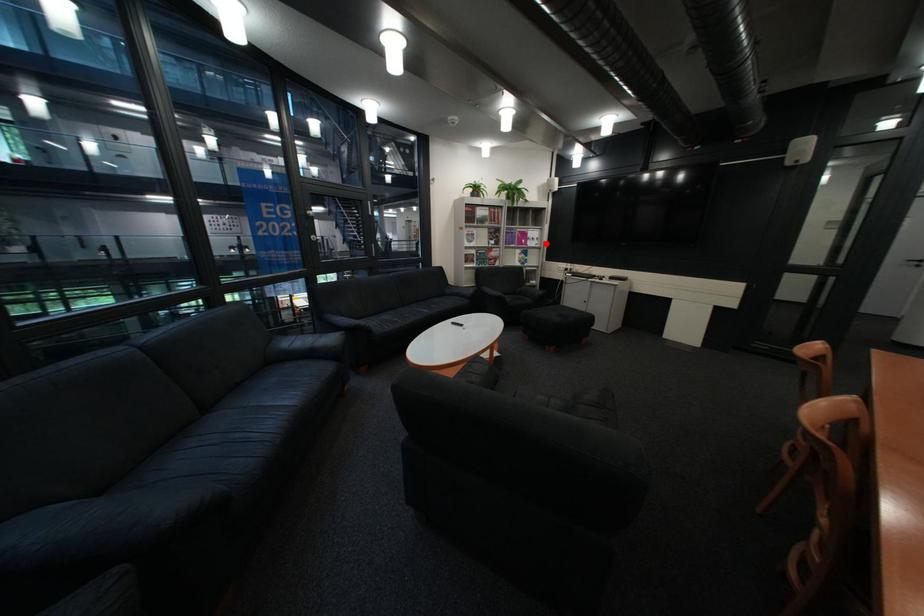
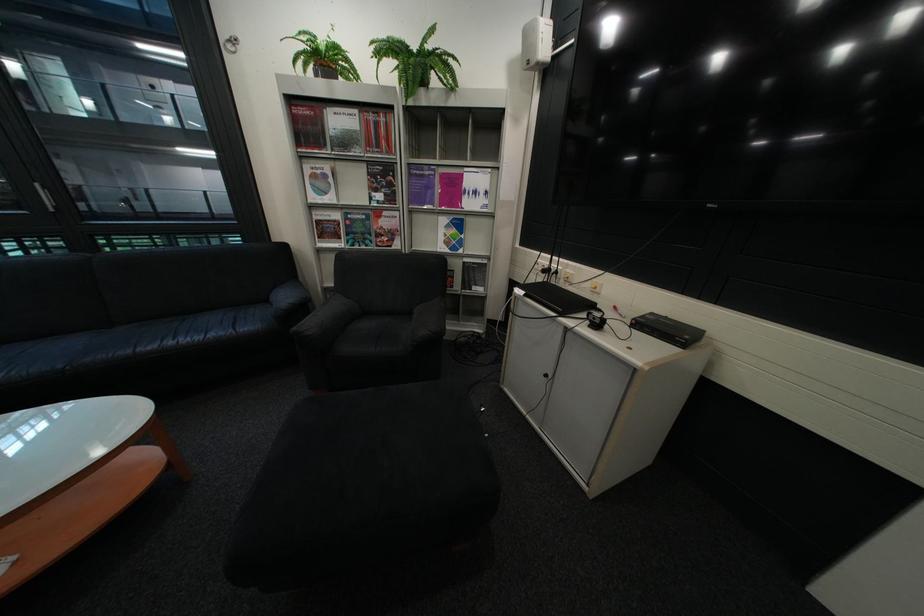
Question: I am providing you with two images of the same scene from different viewpoints. A red point is shown in image1. For the corresponding object point in image2, is it positioned nearer or farther from the camera?

Choices:
 (A) Nearer
 (B) Farther

Answer: (B)